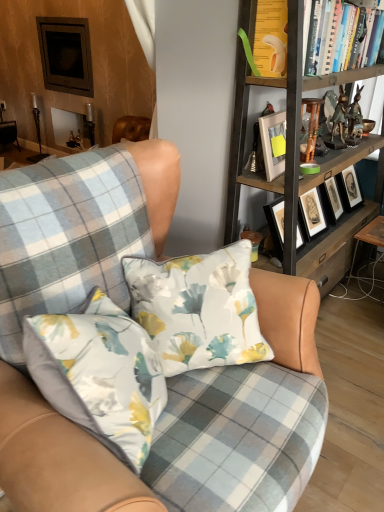
Question: Considering the relative sizes of floral fabric pillow at center and hardcover books at upper right in the image provided, is floral fabric pillow at center thinner than hardcover books at upper right?

Choices:
 (A) yes
 (B) no

Answer: (B)

Question: Does floral fabric pillow at center have a smaller size compared to hardcover books at upper right?

Choices:
 (A) yes
 (B) no

Answer: (B)

Question: Would you consider floral fabric pillow at center to be distant from hardcover books at upper right?

Choices:
 (A) yes
 (B) no

Answer: (A)

Question: From a real-world perspective, does floral fabric pillow at center stand above hardcover books at upper right?

Choices:
 (A) no
 (B) yes

Answer: (A)

Question: Considering the relative positions of floral fabric pillow at center and hardcover books at upper right in the image provided, is floral fabric pillow at center to the left of hardcover books at upper right from the viewer's perspective?

Choices:
 (A) no
 (B) yes

Answer: (B)

Question: Is floral fabric pillow at center inside or outside of hardcover books at upper right?

Choices:
 (A) outside
 (B) inside

Answer: (A)

Question: From the image's perspective, is floral fabric pillow at center above or below hardcover books at upper right?

Choices:
 (A) above
 (B) below

Answer: (B)

Question: Is floral fabric pillow at center to the left or to the right of hardcover books at upper right in the image?

Choices:
 (A) left
 (B) right

Answer: (A)

Question: Considering the positions of floral fabric pillow at center and hardcover books at upper right in the image, is floral fabric pillow at center taller or shorter than hardcover books at upper right?

Choices:
 (A) tall
 (B) short

Answer: (A)

Question: Is wooden table at lower right in front of or behind hardcover books at upper right in the image?

Choices:
 (A) front
 (B) behind

Answer: (B)

Question: Is wooden table at lower right taller or shorter than hardcover books at upper right?

Choices:
 (A) short
 (B) tall

Answer: (B)

Question: Looking at their shapes, would you say wooden table at lower right is wider or thinner than hardcover books at upper right?

Choices:
 (A) thin
 (B) wide

Answer: (B)

Question: Visually, is wooden table at lower right positioned to the left or to the right of hardcover books at upper right?

Choices:
 (A) right
 (B) left

Answer: (A)

Question: Relative to wooden bookshelf at upper right, is white matte picture frame at upper center in front or behind?

Choices:
 (A) front
 (B) behind

Answer: (B)

Question: From a real-world perspective, is white matte picture frame at upper center physically located above or below wooden bookshelf at upper right?

Choices:
 (A) above
 (B) below

Answer: (A)